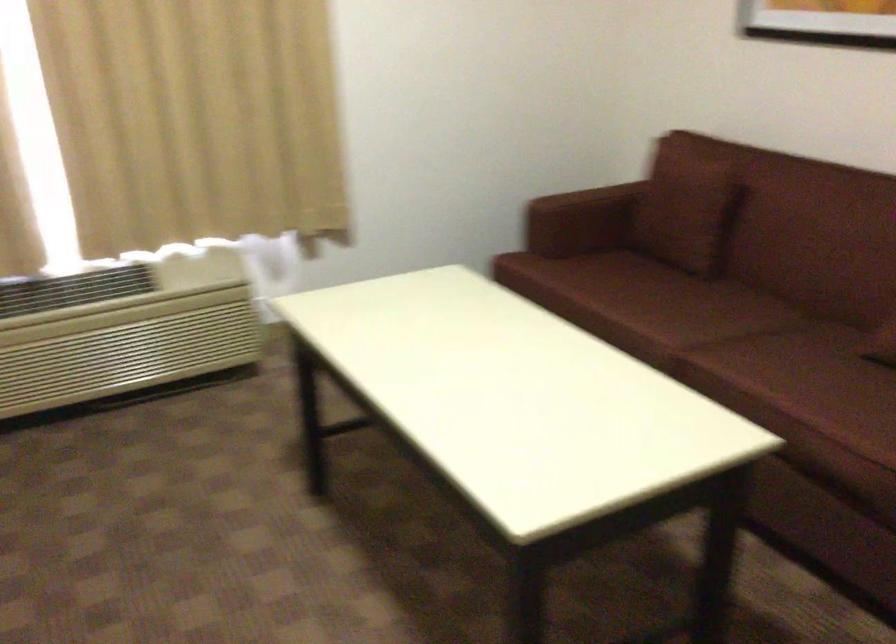
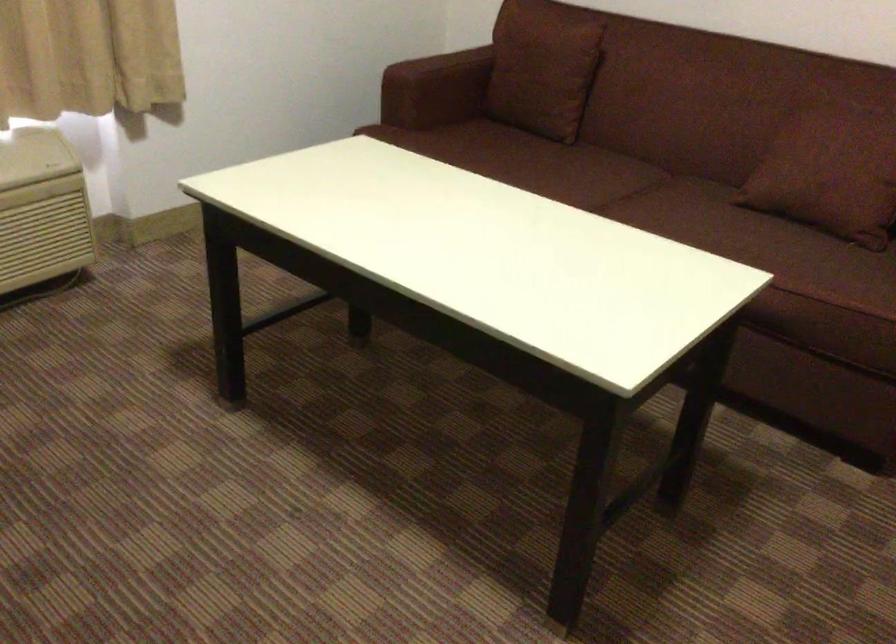
Where in the second image is the point corresponding to (679,310) from the first image?

(574, 176)